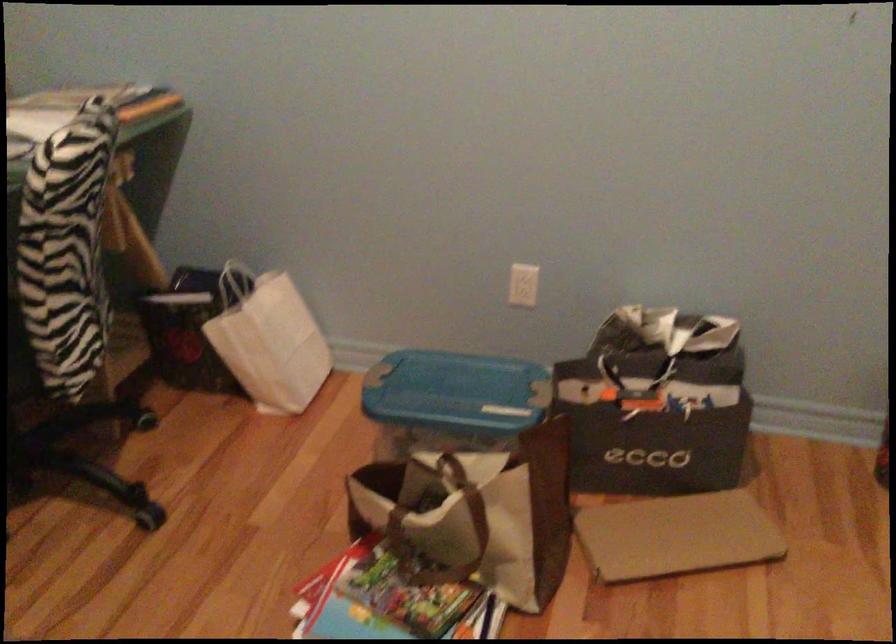
Describe the element at coordinates (634, 383) in the screenshot. This screenshot has height=644, width=896. I see `the dark bag handle` at that location.